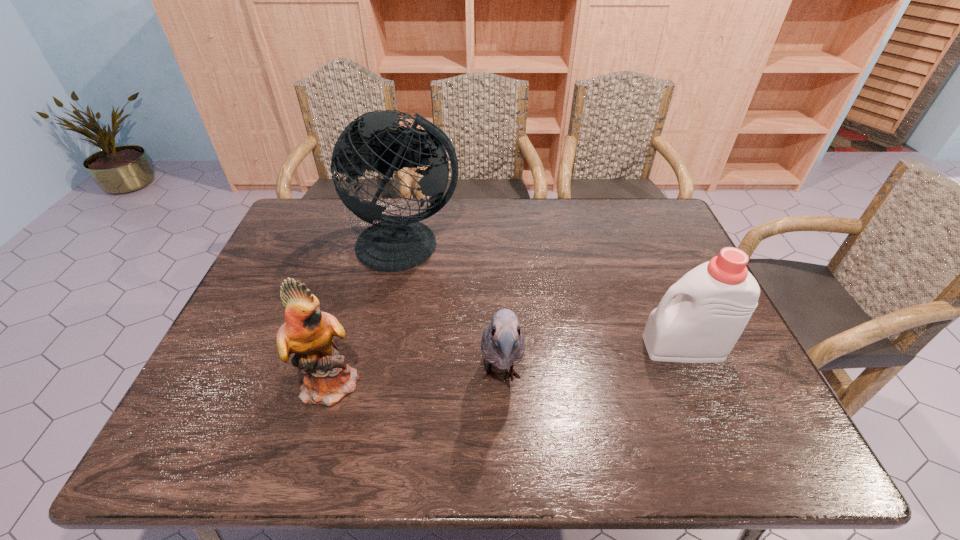
Identify the location of empty location between the left parrot and the shortest object. The width and height of the screenshot is (960, 540). (417, 380).

The height and width of the screenshot is (540, 960). Identify the location of unoccupied area between the farthest object and the detergent. (545, 296).

Where is `empty space between the detergent and the tallest object`? Image resolution: width=960 pixels, height=540 pixels. empty space between the detergent and the tallest object is located at coordinates (545, 296).

Identify the location of vacant area that lies between the second object from right to left and the detergent. (592, 362).

Identify which object is the second nearest to the detergent. Please provide its 2D coordinates. Your answer should be formatted as a tuple, i.e. [(x, y)], where the tuple contains the x and y coordinates of a point satisfying the conditions above.

[(396, 243)]

The height and width of the screenshot is (540, 960). Find the location of `object that stands as the second closest to the rightmost object`. object that stands as the second closest to the rightmost object is located at coordinates (396, 243).

You are a GUI agent. You are given a task and a screenshot of the screen. Output one action in this format:
    pyautogui.click(x=<x>, y=<y>)
    Task: Click on the free space that satisfies the following two spatial constraints: 1. on the front-facing side of the third object from left to right; 2. on the front-facing side of the taller parrot
    This screenshot has width=960, height=540.
    Given the screenshot: What is the action you would take?
    pyautogui.click(x=501, y=382)

I want to click on free space that satisfies the following two spatial constraints: 1. on the front-facing side of the second object from right to left; 2. on the front-facing side of the second tallest object, so click(501, 382).

This screenshot has width=960, height=540. Identify the location of vacant point that satisfies the following two spatial constraints: 1. on the front-facing side of the tallest object; 2. on the front-facing side of the third shortest object. (380, 382).